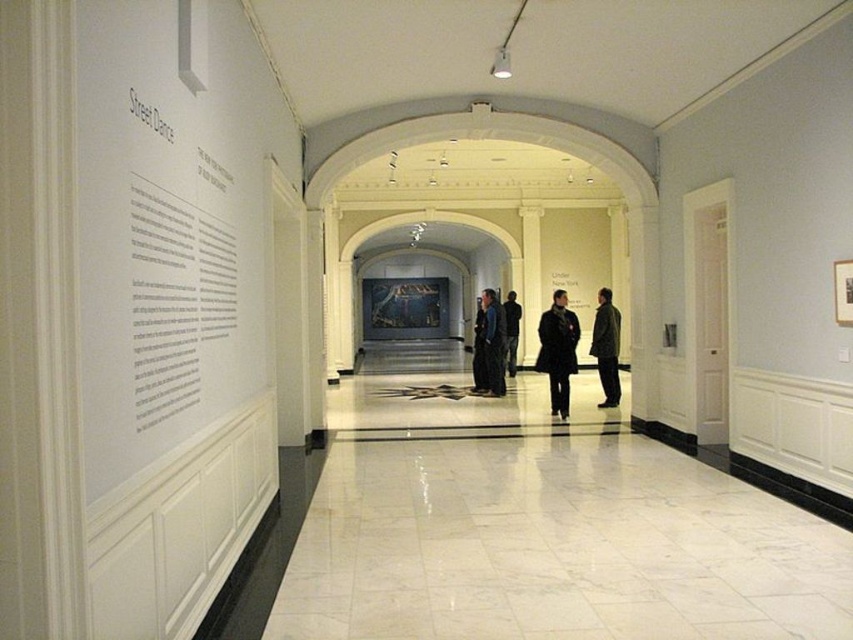
Is dark blue jacket at center wider than dark blue coat at center?

A: Yes, dark blue jacket at center is wider than dark blue coat at center.

Does point (491, 324) come closer to viewer compared to point (509, 317)?

Yes, point (491, 324) is in front of point (509, 317).

I want to click on dark blue jacket at center, so click(x=489, y=346).

Is dark brown leather coat at center positioned before dark brown leather jacket at center?

Yes, it is in front of dark brown leather jacket at center.

Does dark brown leather coat at center have a larger size compared to dark brown leather jacket at center?

Correct, dark brown leather coat at center is larger in size than dark brown leather jacket at center.

Who is more forward, (558, 300) or (599, 358)?

Point (558, 300)

The image size is (853, 640). I want to click on dark brown leather coat at center, so pyautogui.click(x=556, y=349).

Which is more to the right, dark brown leather coat at center or dark blue coat at center?

From the viewer's perspective, dark brown leather coat at center appears more on the right side.

Can you confirm if dark brown leather coat at center is positioned to the left of dark blue coat at center?

No, dark brown leather coat at center is not to the left of dark blue coat at center.

What do you see at coordinates (556, 349) in the screenshot? I see `dark brown leather coat at center` at bounding box center [556, 349].

Locate an element on the screen. This screenshot has height=640, width=853. dark brown leather coat at center is located at coordinates (556, 349).